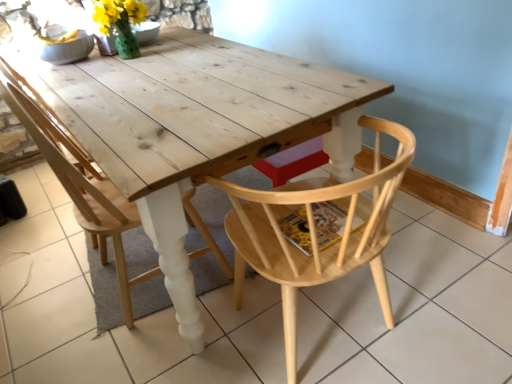
In order to click on free space that is to the left of natural wood chair at center, the 1th chair from the right in this screenshot , I will do `click(203, 341)`.